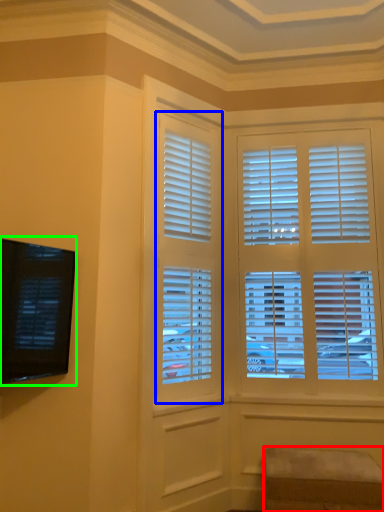
Question: Which object is positioned closest to furniture (highlighted by a red box)? Select from window (highlighted by a blue box) and window screen (highlighted by a green box).

Choices:
 (A) window
 (B) window screen

Answer: (A)